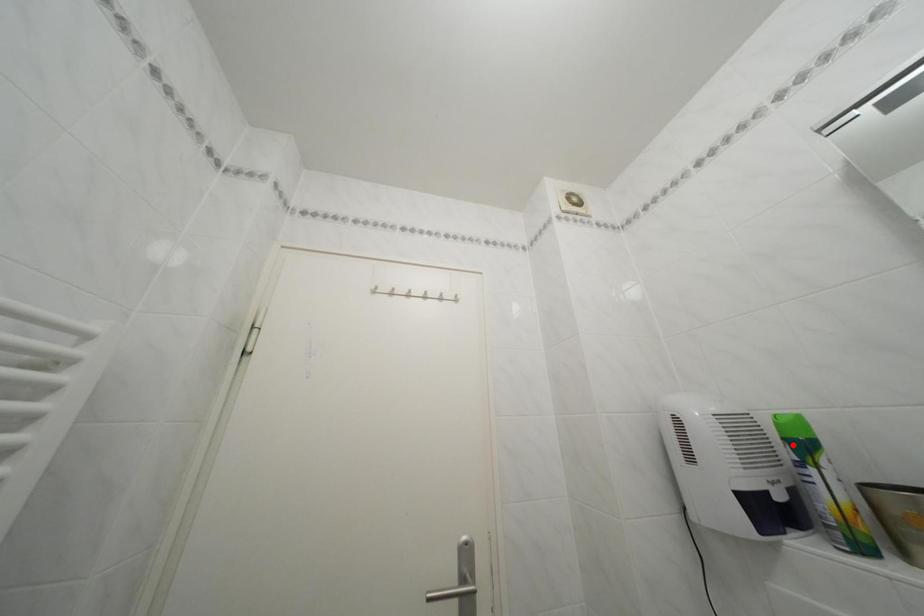
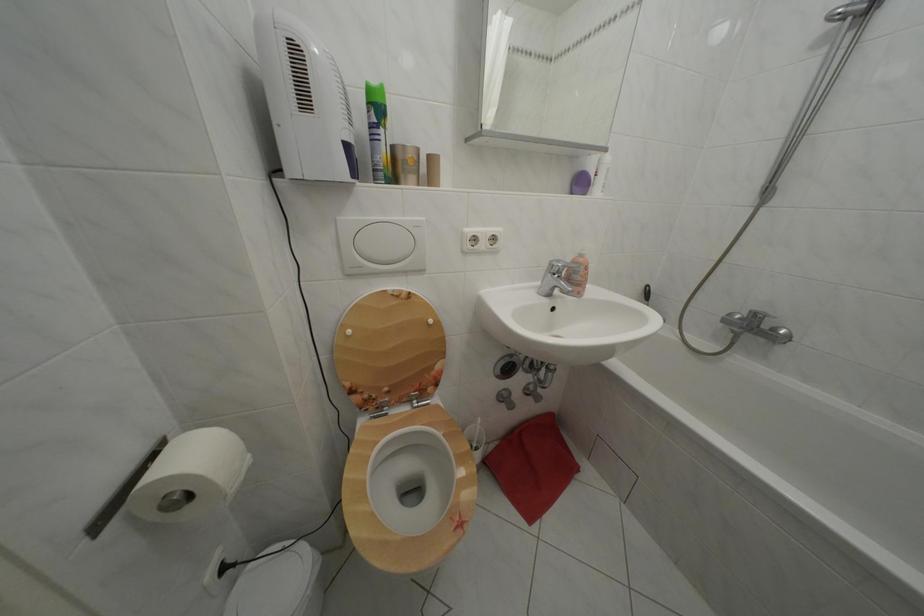
Where in the second image is the point corresponding to the highlighted location from the first image?

(378, 110)